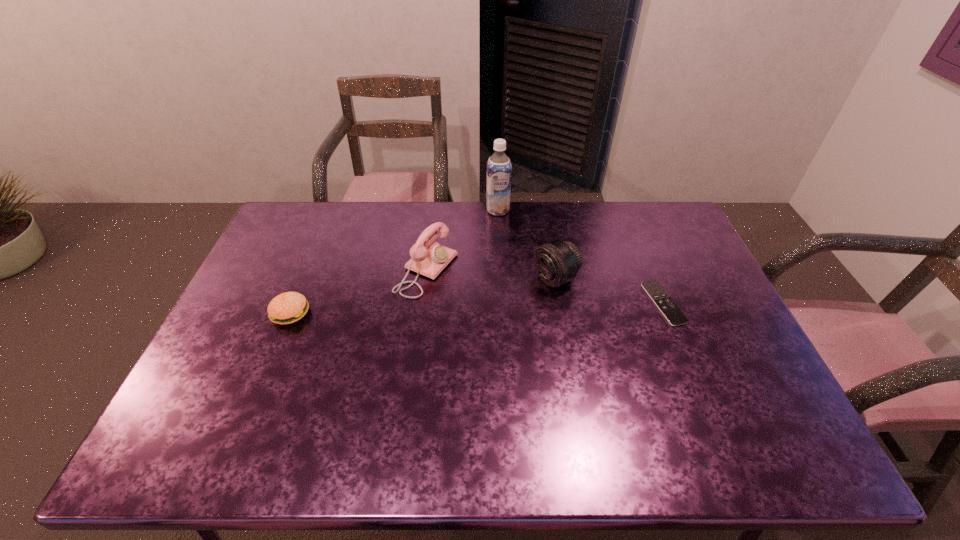
The image size is (960, 540). I want to click on free spot between the patty and the fourth object from left to right, so click(x=423, y=296).

Where is `blank region between the telephoto lens and the telephone`? The width and height of the screenshot is (960, 540). blank region between the telephoto lens and the telephone is located at coordinates (492, 274).

I want to click on vacant space that's between the shortest object and the telephone, so click(545, 287).

Where is `vacant area that lies between the telephoto lens and the leftmost object`? vacant area that lies between the telephoto lens and the leftmost object is located at coordinates (423, 296).

Where is `free point between the patty and the telephoto lens`? This screenshot has height=540, width=960. free point between the patty and the telephoto lens is located at coordinates (423, 296).

This screenshot has height=540, width=960. In order to click on free area in between the farthest object and the second shortest object in this screenshot , I will do coord(395,262).

Choose which object is the third nearest neighbor to the telephoto lens. Please provide its 2D coordinates. Your answer should be formatted as a tuple, i.e. [(x, y)], where the tuple contains the x and y coordinates of a point satisfying the conditions above.

[(499, 169)]

Locate which object ranks second in proximity to the rightmost object. Please provide its 2D coordinates. Your answer should be formatted as a tuple, i.e. [(x, y)], where the tuple contains the x and y coordinates of a point satisfying the conditions above.

[(499, 169)]

Identify the location of free space that satisfies the following two spatial constraints: 1. on the back side of the fourth object from left to right; 2. on the left side of the patty. This screenshot has height=540, width=960. (304, 279).

The width and height of the screenshot is (960, 540). I want to click on free space that satisfies the following two spatial constraints: 1. on the front side of the fourth object from left to right; 2. on the right side of the rightmost object, so click(560, 303).